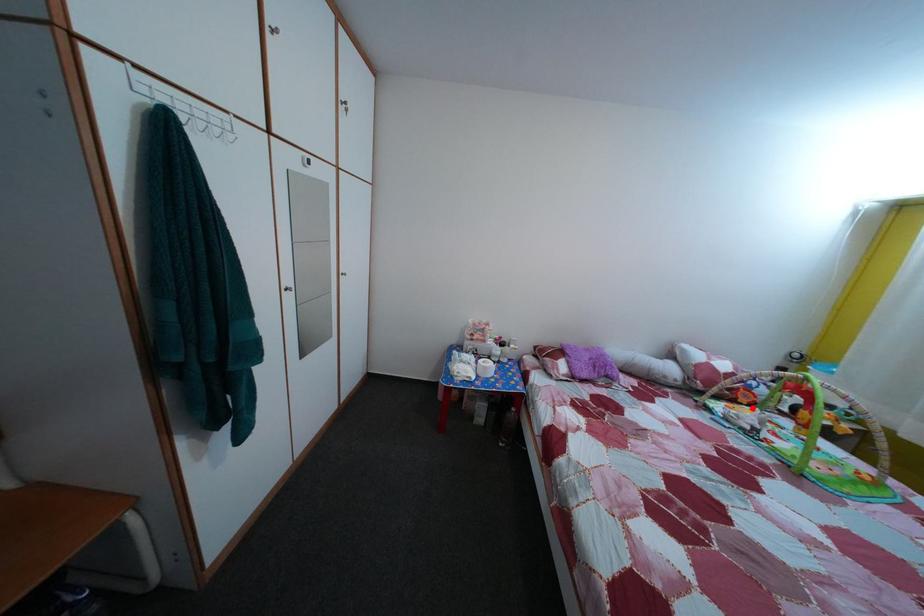
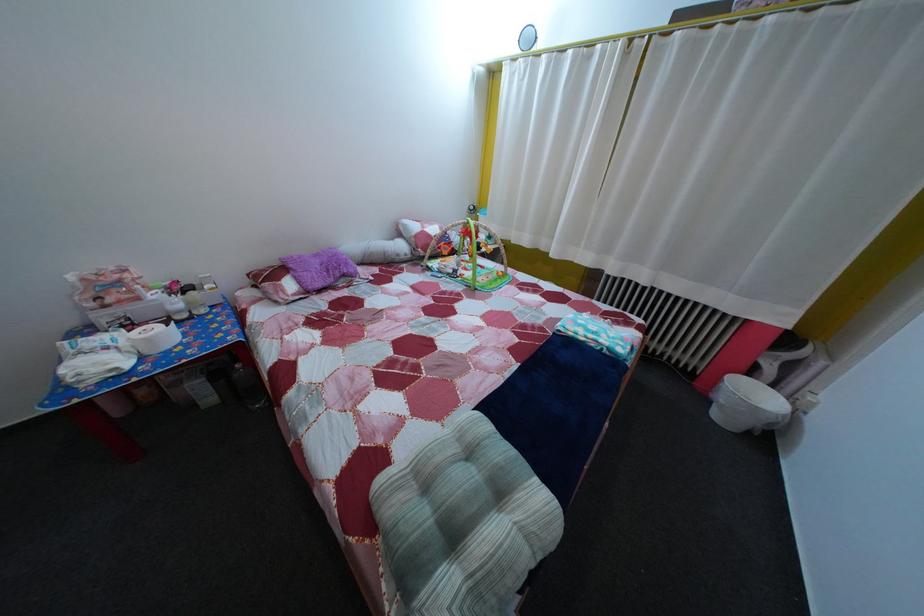
Find the pixel in the second image that matches the highlighted location in the first image.

(455, 261)